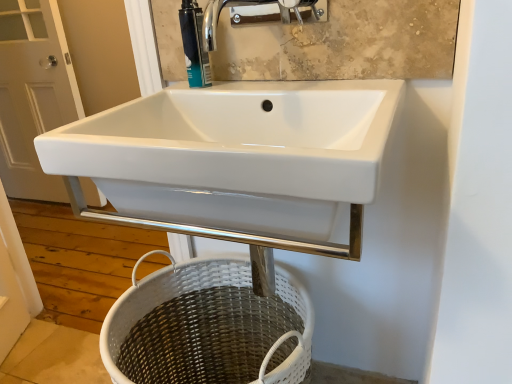
Question: From a real-world perspective, is white glossy sink at center under teal plastic soap dispenser at upper center?

Choices:
 (A) yes
 (B) no

Answer: (A)

Question: From a real-world perspective, is white glossy sink at center on top of teal plastic soap dispenser at upper center?

Choices:
 (A) no
 (B) yes

Answer: (A)

Question: Considering the relative positions of white glossy sink at center and teal plastic soap dispenser at upper center in the image provided, is white glossy sink at center to the left of teal plastic soap dispenser at upper center from the viewer's perspective?

Choices:
 (A) yes
 (B) no

Answer: (B)

Question: Is white glossy sink at center facing away from teal plastic soap dispenser at upper center?

Choices:
 (A) yes
 (B) no

Answer: (B)

Question: Is white glossy sink at center aimed at teal plastic soap dispenser at upper center?

Choices:
 (A) yes
 (B) no

Answer: (B)

Question: From the image's perspective, would you say white glossy sink at center is shown under teal plastic soap dispenser at upper center?

Choices:
 (A) no
 (B) yes

Answer: (B)

Question: Is white glossy door at left wider than chrome metallic faucet at upper center?

Choices:
 (A) yes
 (B) no

Answer: (B)

Question: From the image's perspective, is white glossy door at left below chrome metallic faucet at upper center?

Choices:
 (A) no
 (B) yes

Answer: (A)

Question: Is white glossy door at left outside chrome metallic faucet at upper center?

Choices:
 (A) yes
 (B) no

Answer: (A)

Question: Is chrome metallic faucet at upper center inside white glossy door at left?

Choices:
 (A) yes
 (B) no

Answer: (B)

Question: Can you confirm if white glossy door at left is positioned to the left of chrome metallic faucet at upper center?

Choices:
 (A) no
 (B) yes

Answer: (B)

Question: From a real-world perspective, is white glossy door at left beneath chrome metallic faucet at upper center?

Choices:
 (A) no
 (B) yes

Answer: (B)

Question: Is the depth of white woven basket at lower center greater than that of white glossy door at left?

Choices:
 (A) yes
 (B) no

Answer: (B)